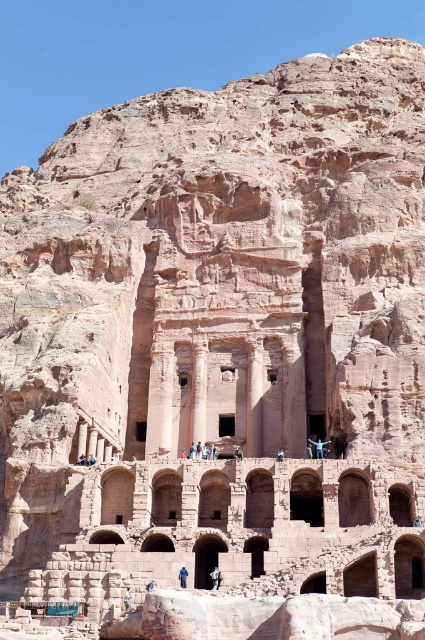
Is dark brown leather jacket at center closer to the viewer compared to blue fabric person at center?

Yes, it is in front of blue fabric person at center.

Measure the distance between dark brown leather jacket at center and camera.

The distance of dark brown leather jacket at center from camera is 60.72 meters.

Is point (214, 582) positioned after point (186, 572)?

Yes, point (214, 582) is farther from viewer.

In order to click on dark brown leather jacket at center in this screenshot , I will do `click(215, 577)`.